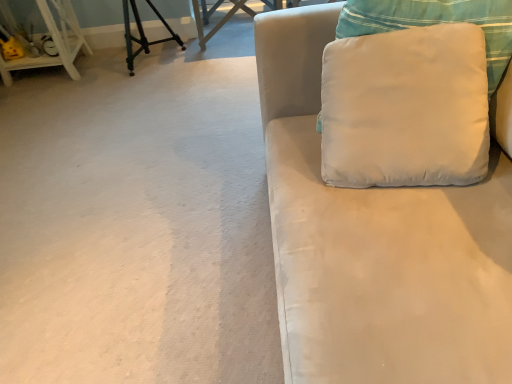
Question: Is wooden table at upper center looking in the opposite direction of white wood shelf at left?

Choices:
 (A) yes
 (B) no

Answer: (B)

Question: Can you confirm if wooden table at upper center is taller than white wood shelf at left?

Choices:
 (A) yes
 (B) no

Answer: (B)

Question: Is wooden table at upper center outside of white wood shelf at left?

Choices:
 (A) yes
 (B) no

Answer: (A)

Question: From a real-world perspective, is wooden table at upper center on top of white wood shelf at left?

Choices:
 (A) no
 (B) yes

Answer: (A)

Question: Can you confirm if wooden table at upper center is positioned to the left of white wood shelf at left?

Choices:
 (A) no
 (B) yes

Answer: (A)

Question: From a real-world perspective, is satin white couch at right positioned above or below white wood shelf at left?

Choices:
 (A) above
 (B) below

Answer: (A)

Question: From their relative heights in the image, would you say satin white couch at right is taller or shorter than white wood shelf at left?

Choices:
 (A) tall
 (B) short

Answer: (A)

Question: In terms of width, does satin white couch at right look wider or thinner when compared to white wood shelf at left?

Choices:
 (A) wide
 (B) thin

Answer: (A)

Question: Based on their sizes in the image, would you say satin white couch at right is bigger or smaller than white wood shelf at left?

Choices:
 (A) big
 (B) small

Answer: (A)

Question: Relative to wooden table at upper center, is white fabric pillow at upper right in front or behind?

Choices:
 (A) behind
 (B) front

Answer: (B)

Question: Choose the correct answer: Is white fabric pillow at upper right inside wooden table at upper center or outside it?

Choices:
 (A) outside
 (B) inside

Answer: (A)

Question: Considering the positions of white fabric pillow at upper right and wooden table at upper center in the image, is white fabric pillow at upper right bigger or smaller than wooden table at upper center?

Choices:
 (A) big
 (B) small

Answer: (A)

Question: From the image's perspective, is white fabric pillow at upper right above or below wooden table at upper center?

Choices:
 (A) above
 (B) below

Answer: (B)

Question: From a real-world perspective, is satin white couch at right above or below white fabric pillow at upper right?

Choices:
 (A) below
 (B) above

Answer: (A)

Question: Considering the positions of point tap(279, 309) and point tap(326, 48), is point tap(279, 309) closer or farther from the camera than point tap(326, 48)?

Choices:
 (A) farther
 (B) closer

Answer: (B)